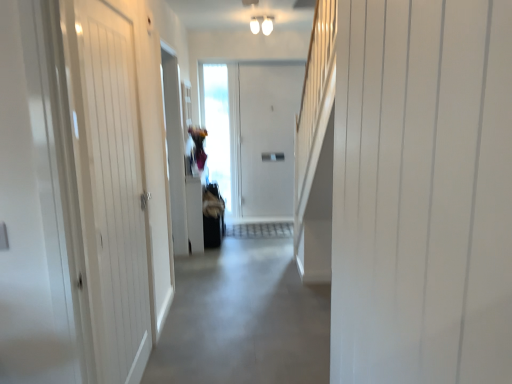
Question: From the image's perspective, would you say gray concrete floor at center is positioned over white wooden door at left, the 1th door in the left-to-right sequence?

Choices:
 (A) yes
 (B) no

Answer: (B)

Question: From the image's perspective, is gray concrete floor at center located beneath white wooden door at left, which appears as the second door when viewed from the front?

Choices:
 (A) no
 (B) yes

Answer: (B)

Question: Is gray concrete floor at center smaller than white wooden door at left, the first door when ordered from back to front?

Choices:
 (A) yes
 (B) no

Answer: (B)

Question: Is gray concrete floor at center not inside white wooden door at left, the 1th door in the left-to-right sequence?

Choices:
 (A) no
 (B) yes

Answer: (B)

Question: Is gray concrete floor at center positioned before white wooden door at left, the second door from the right?

Choices:
 (A) yes
 (B) no

Answer: (B)

Question: From a real-world perspective, is white wooden door at left, the second door from the right, above or below white smooth door at right, which appears as the 1th door when viewed from the right?

Choices:
 (A) below
 (B) above

Answer: (A)

Question: In the image, is white wooden door at left, the second door from the right, on the left side or the right side of white smooth door at right, which is the 2th door in back-to-front order?

Choices:
 (A) right
 (B) left

Answer: (B)

Question: In the image, is white wooden door at left, the second door from the right, positioned in front of or behind white smooth door at right, marked as the first door in a front-to-back arrangement?

Choices:
 (A) behind
 (B) front

Answer: (A)

Question: From the image's perspective, is white wooden door at left, which appears as the second door when viewed from the front, above or below white smooth door at right, which appears as the 1th door when viewed from the right?

Choices:
 (A) below
 (B) above

Answer: (B)

Question: Is white smooth door at right, marked as the first door in a front-to-back arrangement, in front of or behind white wooden door at left, the 1th door in the left-to-right sequence, in the image?

Choices:
 (A) front
 (B) behind

Answer: (A)

Question: Looking at the image, does white smooth door at right, which appears as the 1th door when viewed from the right, seem bigger or smaller compared to white wooden door at left, the 1th door in the left-to-right sequence?

Choices:
 (A) small
 (B) big

Answer: (B)

Question: From a real-world perspective, is white smooth door at right, which is the 2th door in back-to-front order, above or below white wooden door at left, the 1th door in the left-to-right sequence?

Choices:
 (A) above
 (B) below

Answer: (A)

Question: From the image's perspective, is white smooth door at right, which appears as the 1th door when viewed from the right, positioned above or below white wooden door at left, the second door from the right?

Choices:
 (A) below
 (B) above

Answer: (A)

Question: From a real-world perspective, is white smooth door at right, which is the 2th door in back-to-front order, positioned above or below gray concrete floor at center?

Choices:
 (A) below
 (B) above

Answer: (B)

Question: From the image's perspective, relative to gray concrete floor at center, is white smooth door at right, marked as the first door in a front-to-back arrangement, above or below?

Choices:
 (A) above
 (B) below

Answer: (A)